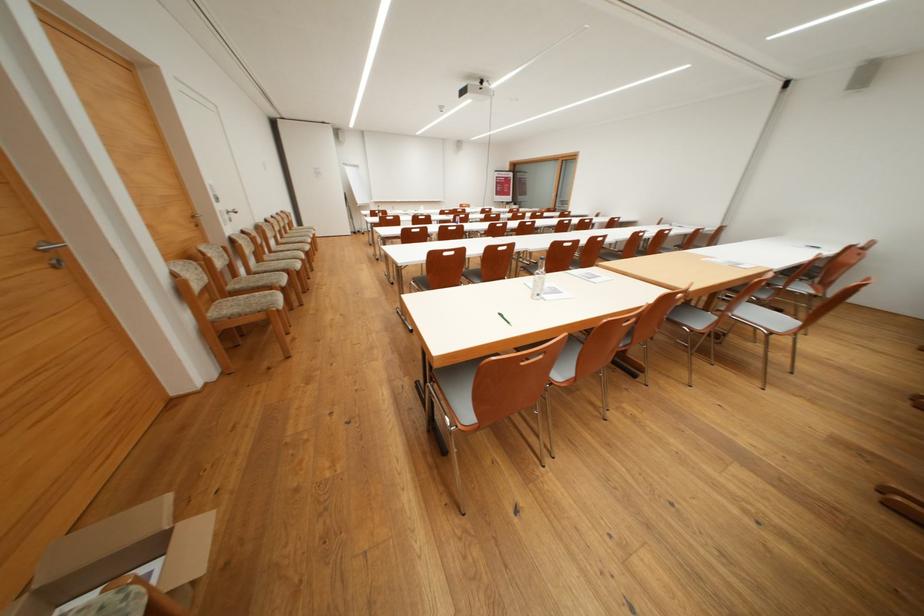
Locate an element on the screen. The image size is (924, 616). metal door handle is located at coordinates tap(47, 246).